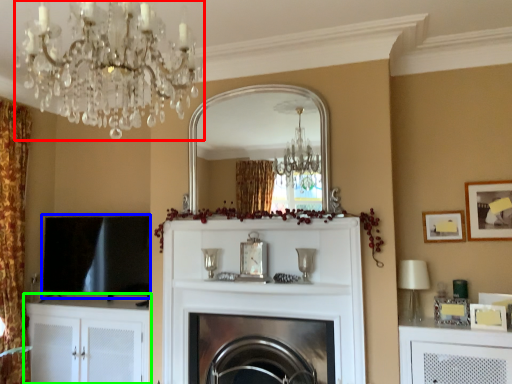
Question: Considering the real-world distances, which object is farthest from light fixture (highlighted by a red box)? window screen (highlighted by a blue box) or cabinetry (highlighted by a green box)?

Choices:
 (A) window screen
 (B) cabinetry

Answer: (B)